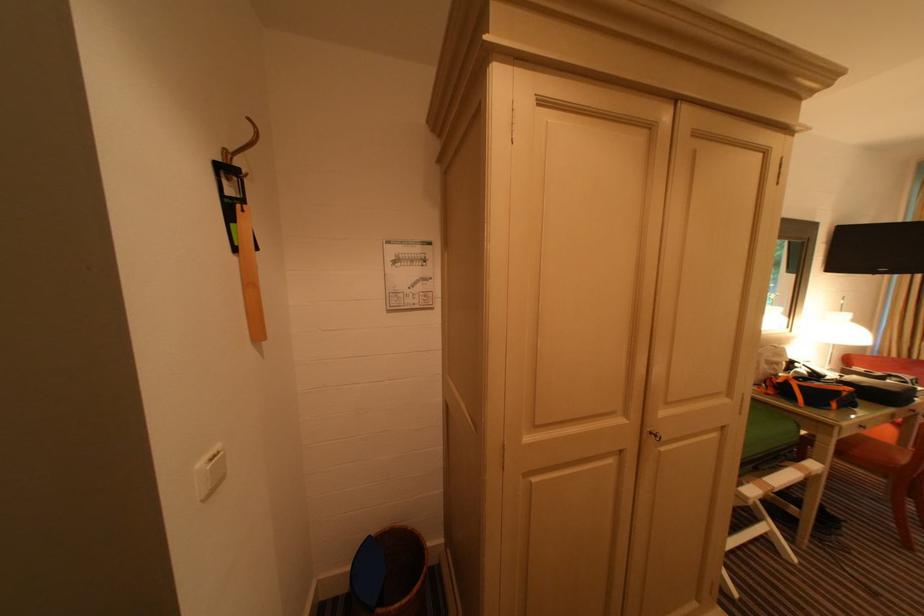
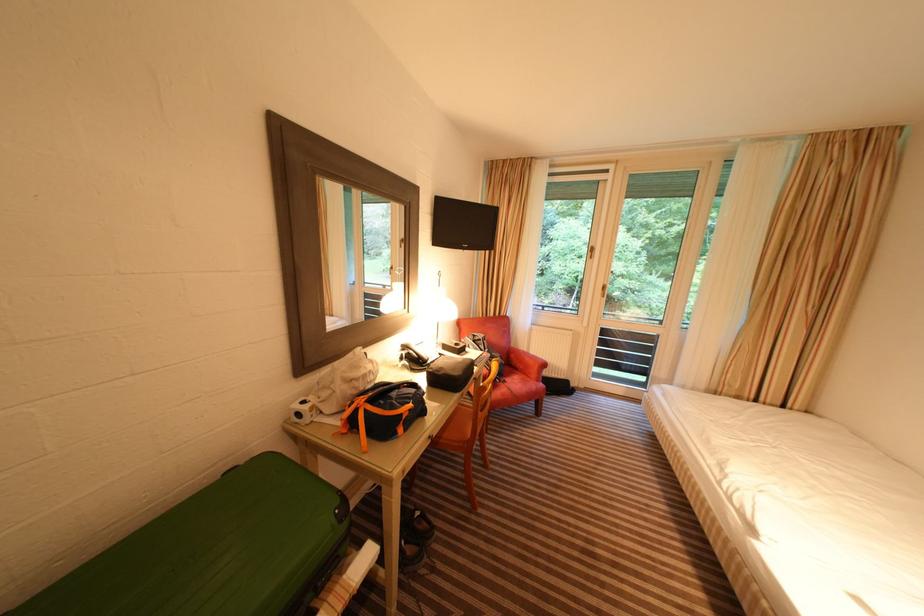
The point at (845, 394) is marked in the first image. Where is the corresponding point in the second image?

(407, 416)